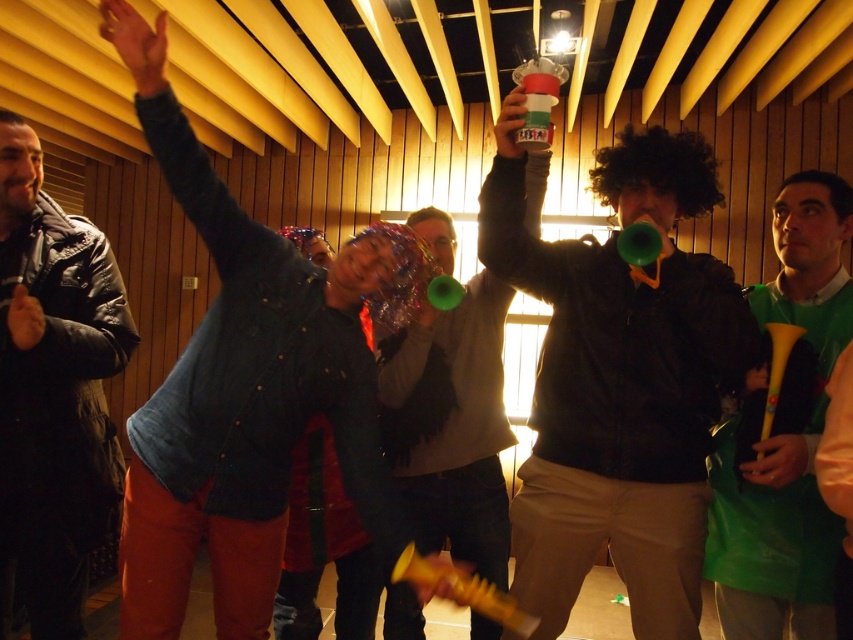
Question: Does denim jacket at center have a larger size compared to leather jacket at left?

Choices:
 (A) no
 (B) yes

Answer: (B)

Question: Considering the real-world distances, which object is closest to the shiny green horn at center?

Choices:
 (A) denim jacket at center
 (B) matte black jacket at center
 (C) green plastic horn at right
 (D) leather jacket at left

Answer: (B)

Question: Does denim jacket at center lie behind leather jacket at left?

Choices:
 (A) no
 (B) yes

Answer: (A)

Question: Which point is closer to the camera taking this photo?

Choices:
 (A) (556, 410)
 (B) (450, 378)
 (C) (61, 438)
 (D) (376, 534)

Answer: (D)

Question: Considering the real-world distances, which object is closest to the matte black jacket at center?

Choices:
 (A) leather jacket at left
 (B) denim jacket at center
 (C) shiny green horn at center

Answer: (C)

Question: Can you confirm if matte black jacket at center is thinner than shiny green horn at center?

Choices:
 (A) no
 (B) yes

Answer: (A)